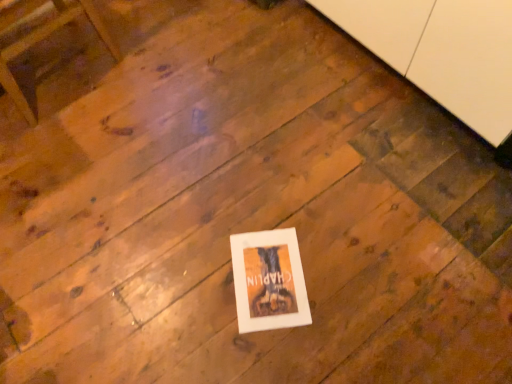
Question: Does white matte cabinet at upper right appear on the left side of wooden chair at upper left?

Choices:
 (A) yes
 (B) no

Answer: (B)

Question: Would you say white matte cabinet at upper right is a long distance from wooden chair at upper left?

Choices:
 (A) no
 (B) yes

Answer: (B)

Question: Is white matte cabinet at upper right oriented towards wooden chair at upper left?

Choices:
 (A) yes
 (B) no

Answer: (A)

Question: Is white matte cabinet at upper right beside wooden chair at upper left?

Choices:
 (A) yes
 (B) no

Answer: (B)

Question: From the image's perspective, is white matte cabinet at upper right above wooden chair at upper left?

Choices:
 (A) no
 (B) yes

Answer: (B)

Question: From the image's perspective, relative to wooden chair at upper left, is white matte cabinet at upper right above or below?

Choices:
 (A) below
 (B) above

Answer: (B)

Question: In the image, is white matte cabinet at upper right on the left side or the right side of wooden chair at upper left?

Choices:
 (A) right
 (B) left

Answer: (A)

Question: Is white matte cabinet at upper right in front of or behind wooden chair at upper left in the image?

Choices:
 (A) front
 (B) behind

Answer: (A)

Question: Does point (480, 74) appear closer or farther from the camera than point (26, 117)?

Choices:
 (A) closer
 (B) farther

Answer: (A)

Question: Is wooden chair at upper left bigger or smaller than white matte cabinet at upper right?

Choices:
 (A) big
 (B) small

Answer: (B)

Question: Which is correct: wooden chair at upper left is inside white matte cabinet at upper right, or outside of it?

Choices:
 (A) inside
 (B) outside

Answer: (B)

Question: From the image's perspective, is wooden chair at upper left above or below white matte cabinet at upper right?

Choices:
 (A) above
 (B) below

Answer: (B)

Question: Considering their positions, is wooden chair at upper left located in front of or behind white matte cabinet at upper right?

Choices:
 (A) front
 (B) behind

Answer: (B)

Question: Looking at the image, does white paper at center seem bigger or smaller compared to wooden chair at upper left?

Choices:
 (A) big
 (B) small

Answer: (B)

Question: In terms of width, does white paper at center look wider or thinner when compared to wooden chair at upper left?

Choices:
 (A) wide
 (B) thin

Answer: (B)